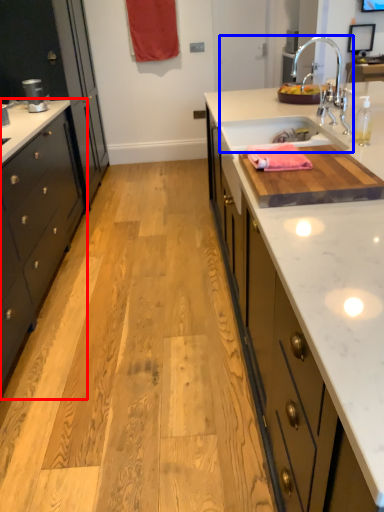
Question: Which object appears farthest to the camera in this image, cabinetry (highlighted by a red box) or sink (highlighted by a blue box)?

Choices:
 (A) cabinetry
 (B) sink

Answer: (B)